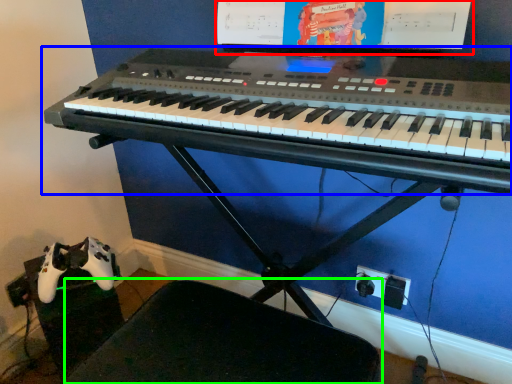
Question: Which is nearer to the computer monitor (highlighted by a red box)? musical keyboard (highlighted by a blue box) or swivel chair (highlighted by a green box).

Choices:
 (A) musical keyboard
 (B) swivel chair

Answer: (A)